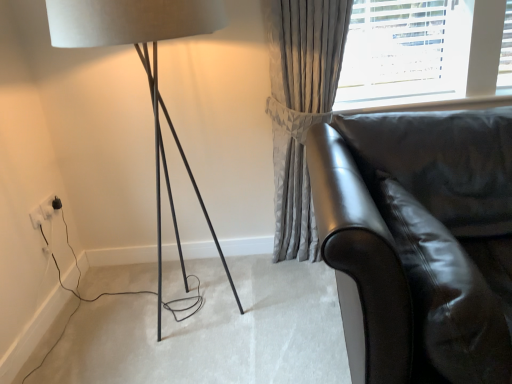
This screenshot has width=512, height=384. In order to click on unoccupied region to the right of matte black lamp at left in this screenshot , I will do `click(281, 313)`.